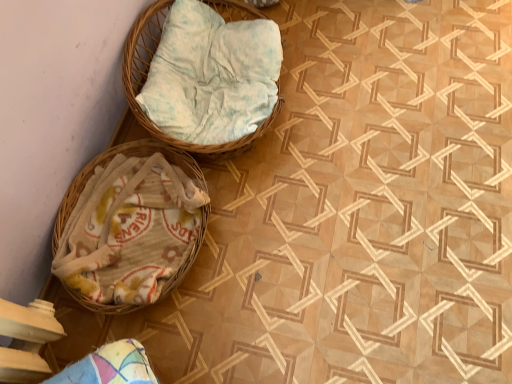
Question: Is woven wicker basket at upper center, the first basket positioned from the top, spatially inside white woven basket at left, which appears as the 1th basket when ordered from the bottom, or outside of it?

Choices:
 (A) inside
 (B) outside

Answer: (B)

Question: Is point (132, 29) positioned closer to the camera than point (130, 259)?

Choices:
 (A) farther
 (B) closer

Answer: (A)

Question: From a real-world perspective, relative to white woven basket at left, which appears as the 1th basket when ordered from the bottom, is woven wicker basket at upper center, marked as the 2th basket in a bottom-to-top arrangement, vertically above or below?

Choices:
 (A) above
 (B) below

Answer: (A)

Question: Considering the positions of white woven basket at left, which appears as the 1th basket when ordered from the bottom, and woven wicker basket at upper center, the first basket positioned from the top, in the image, is white woven basket at left, which appears as the 1th basket when ordered from the bottom, taller or shorter than woven wicker basket at upper center, the first basket positioned from the top,?

Choices:
 (A) tall
 (B) short

Answer: (B)

Question: From a real-world perspective, relative to woven wicker basket at upper center, the first basket positioned from the top, is white woven basket at left, which appears as the 2th basket when viewed from the top, vertically above or below?

Choices:
 (A) above
 (B) below

Answer: (B)

Question: Would you say white woven basket at left, which appears as the 1th basket when ordered from the bottom, is to the left or to the right of woven wicker basket at upper center, the first basket positioned from the top, in the picture?

Choices:
 (A) left
 (B) right

Answer: (A)

Question: Is point (113, 251) positioned closer to the camera than point (126, 61)?

Choices:
 (A) closer
 (B) farther

Answer: (A)